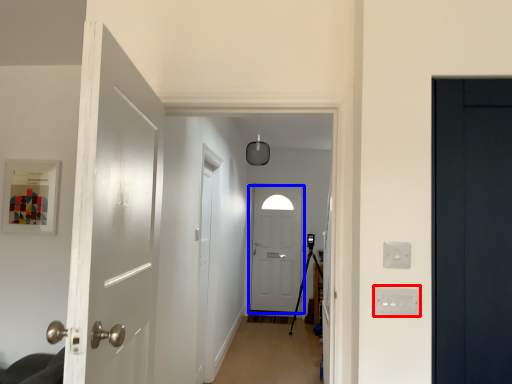
Question: Which object is closer to the camera taking this photo, electric outlet (highlighted by a red box) or door (highlighted by a blue box)?

Choices:
 (A) electric outlet
 (B) door

Answer: (A)